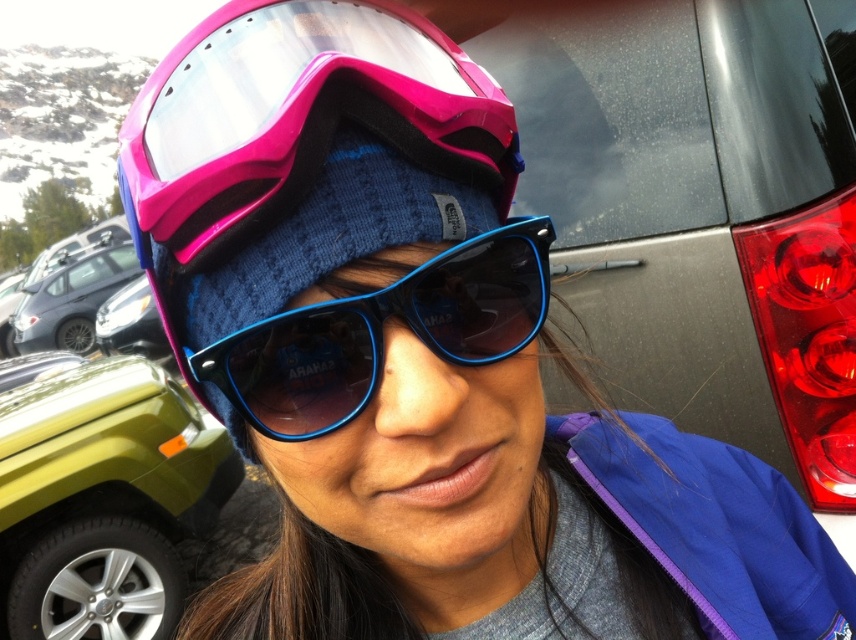
Does green matte jeep at lower left have a smaller size compared to blue plastic sunglasses at center?

Incorrect, green matte jeep at lower left is not smaller in size than blue plastic sunglasses at center.

Can you confirm if green matte jeep at lower left is wider than blue plastic sunglasses at center?

Yes.

Is point (149, 381) positioned in front of point (262, 324)?

No, it is not.

Find the location of a particular element. The height and width of the screenshot is (640, 856). green matte jeep at lower left is located at coordinates (103, 499).